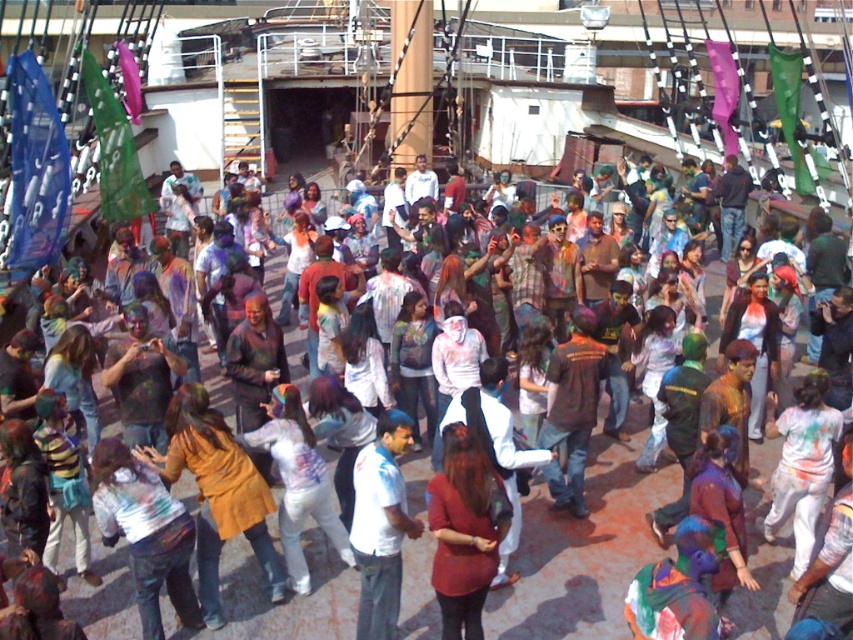
You are a photographer trying to capture a photo of the matte red shirt at center and the white cotton shirt at center. Which one is more to the right in the image?

The matte red shirt at center is positioned on the right side of the white cotton shirt at center, so the matte red shirt at center is more to the right.

You are a photographer at the Holi festival and want to capture a photo of the matte red shirt at center and the white cotton shirt at center. Which shirt is positioned higher in the frame?

The matte red shirt at center is positioned higher in the frame than the white cotton shirt at center.